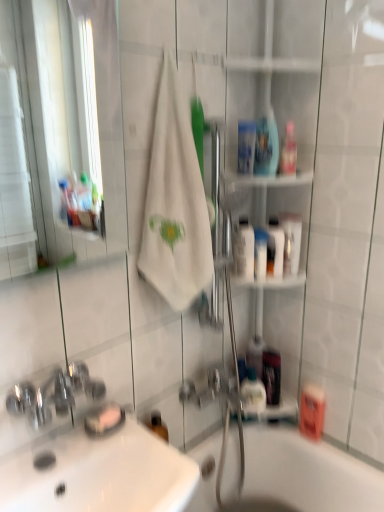
Question: Is clear plastic mouthwash at upper center, placed as the 7th mouthwash when sorted from bottom to top, not near white glossy bottle at center-right, arranged as the 4th mouthwash when ordered from the bottom?

Choices:
 (A) yes
 (B) no

Answer: (B)

Question: From a real-world perspective, is clear plastic mouthwash at upper center, which is the 3th mouthwash from top to bottom, physically below white glossy bottle at center-right, arranged as the 4th mouthwash when ordered from the bottom?

Choices:
 (A) no
 (B) yes

Answer: (A)

Question: Considering the relative sizes of clear plastic mouthwash at upper center, which is the 3th mouthwash from top to bottom, and white glossy bottle at center-right, arranged as the 6th mouthwash when viewed from the top, in the image provided, is clear plastic mouthwash at upper center, which is the 3th mouthwash from top to bottom, shorter than white glossy bottle at center-right, arranged as the 6th mouthwash when viewed from the top,?

Choices:
 (A) no
 (B) yes

Answer: (B)

Question: Is clear plastic mouthwash at upper center, placed as the 7th mouthwash when sorted from bottom to top, to the left of white glossy bottle at center-right, arranged as the 4th mouthwash when ordered from the bottom, from the viewer's perspective?

Choices:
 (A) no
 (B) yes

Answer: (B)

Question: From the image's perspective, is clear plastic mouthwash at upper center, placed as the 7th mouthwash when sorted from bottom to top, located beneath white glossy bottle at center-right, arranged as the 6th mouthwash when viewed from the top?

Choices:
 (A) no
 (B) yes

Answer: (A)

Question: Is pink plastic mouthwash at upper center, which is the second mouthwash in top-to-bottom order, situated inside clear plastic mouthwash at upper center, placed as the 7th mouthwash when sorted from bottom to top, or outside?

Choices:
 (A) inside
 (B) outside

Answer: (B)

Question: Is point (284, 152) closer or farther from the camera than point (244, 137)?

Choices:
 (A) closer
 (B) farther

Answer: (B)

Question: From their relative heights in the image, would you say pink plastic mouthwash at upper center, the 8th mouthwash in the bottom-to-top sequence, is taller or shorter than clear plastic mouthwash at upper center, placed as the 7th mouthwash when sorted from bottom to top?

Choices:
 (A) tall
 (B) short

Answer: (A)

Question: Relative to clear plastic mouthwash at upper center, which is the 3th mouthwash from top to bottom, is pink plastic mouthwash at upper center, which is the second mouthwash in top-to-bottom order, in front or behind?

Choices:
 (A) front
 (B) behind

Answer: (A)

Question: Is clear plastic mouthwash at upper center, placed as the 7th mouthwash when sorted from bottom to top, wider or thinner than pink plastic mouthwash at upper center, the 8th mouthwash in the bottom-to-top sequence?

Choices:
 (A) thin
 (B) wide

Answer: (A)

Question: Considering the positions of point (248, 128) and point (296, 159), is point (248, 128) closer or farther from the camera than point (296, 159)?

Choices:
 (A) closer
 (B) farther

Answer: (A)

Question: Is clear plastic mouthwash at upper center, which is the 3th mouthwash from top to bottom, bigger or smaller than pink plastic mouthwash at upper center, the 8th mouthwash in the bottom-to-top sequence?

Choices:
 (A) big
 (B) small

Answer: (A)

Question: From the image's perspective, relative to pink plastic mouthwash at upper center, which is the second mouthwash in top-to-bottom order, is clear plastic mouthwash at upper center, placed as the 7th mouthwash when sorted from bottom to top, above or below?

Choices:
 (A) below
 (B) above

Answer: (A)

Question: In terms of width, does white cotton towel at center look wider or thinner when compared to white glossy sink at lower left?

Choices:
 (A) wide
 (B) thin

Answer: (B)

Question: Looking at the image, does white cotton towel at center seem bigger or smaller compared to white glossy sink at lower left?

Choices:
 (A) small
 (B) big

Answer: (B)